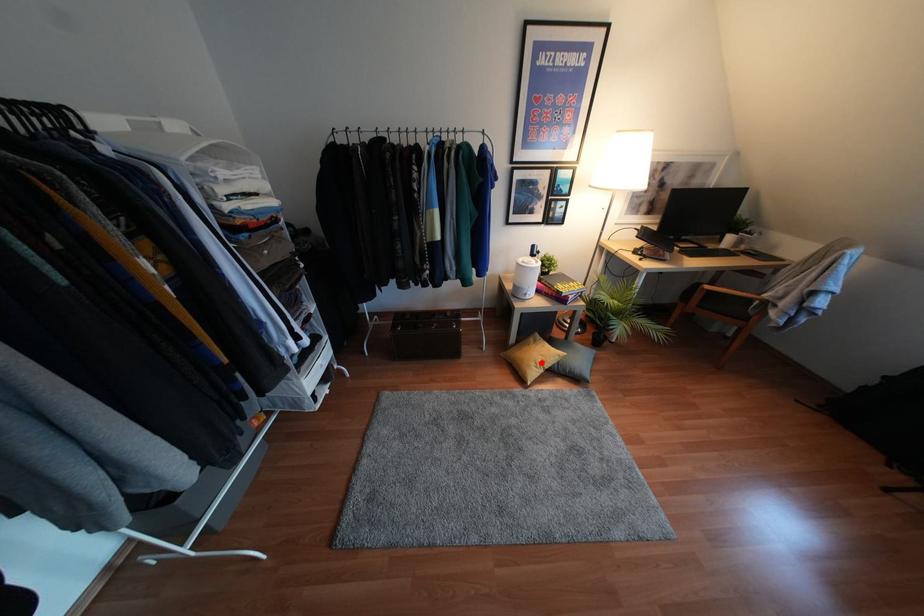
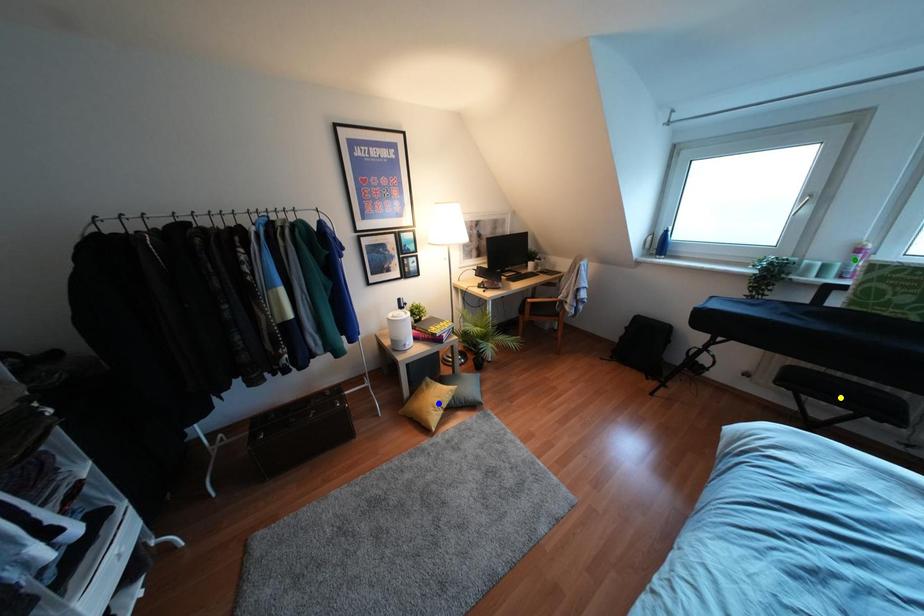
Question: I am providing you with two images of the same scene from different viewpoints. A red point is marked on the first image. You are given multiple points on the second image. In image 2, which mark is for the same physical point as the one in image 1?

Choices:
 (A) blue point
 (B) yellow point
 (C) green point

Answer: (A)